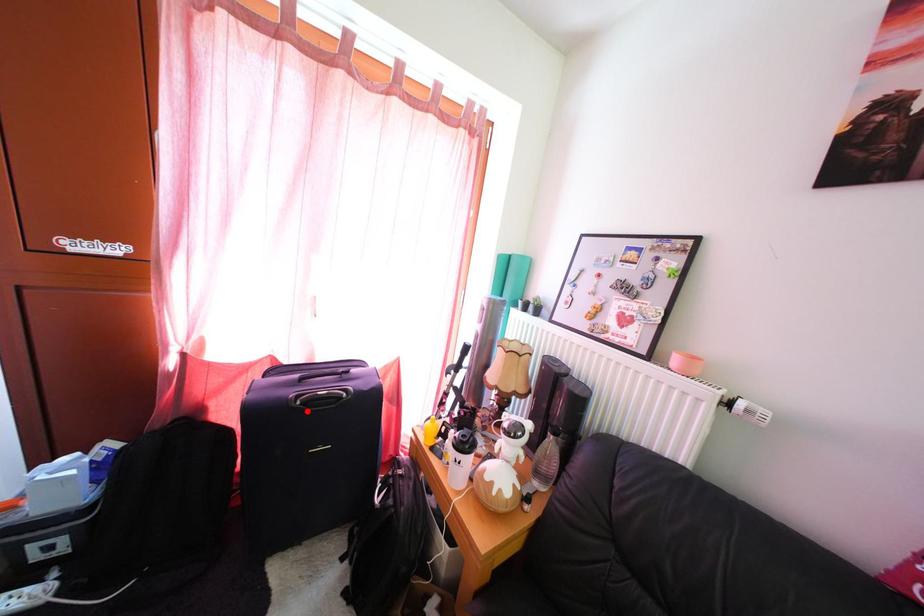
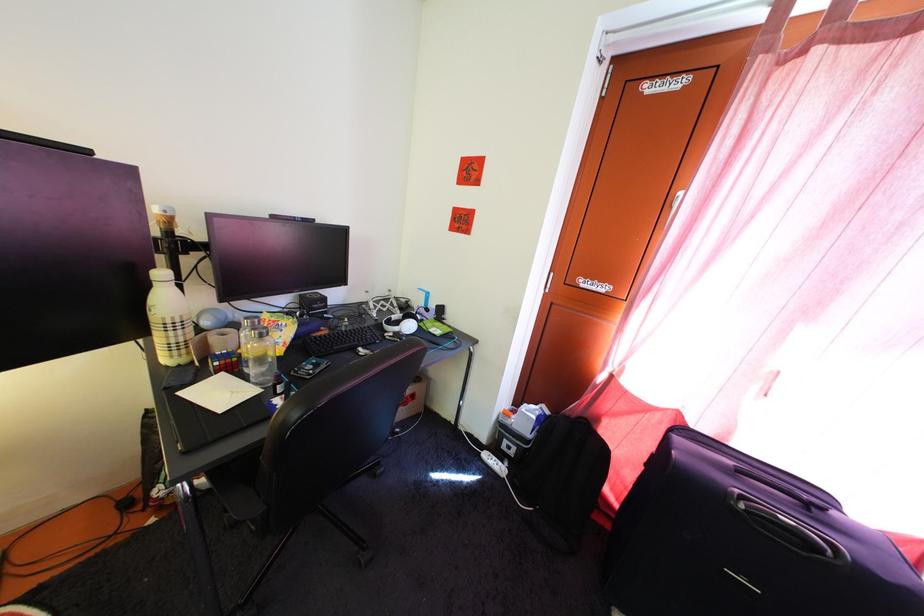
In the second image, find the point that corresponds to the highlighted location in the first image.

(751, 515)